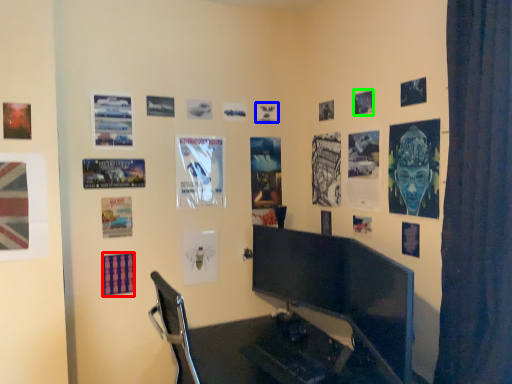
Question: Based on their relative distances, which object is farther from poster page (highlighted by a red box)? Choose from poster page (highlighted by a blue box) and poster page (highlighted by a green box).

Choices:
 (A) poster page
 (B) poster page

Answer: (B)